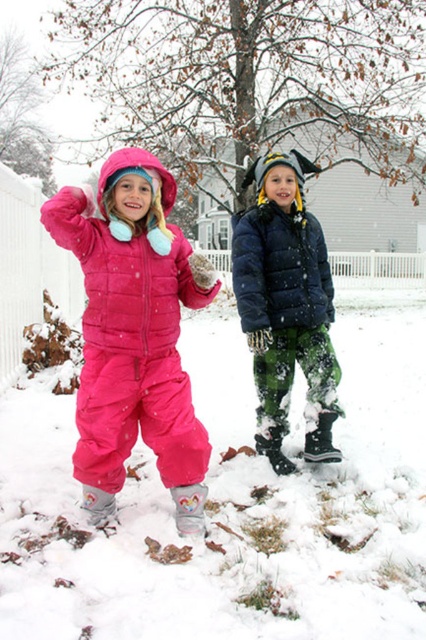
In the scene shown: You are trying to locate the pink matte snowsuit at center and the matte black jacket at center in the snowy scene. Which one is positioned to the left?

The pink matte snowsuit at center is to the left of the matte black jacket at center.

You are a drone operator trying to capture aerial footage of two children playing in the snow. You need to position your drone between the two points marked as point (158, 344) and point (322, 422). Since you want the drone to be closer to the child on the left, which point should you choose?

Point (158, 344) is in front of point (322, 422). Since the child on the left is closer to the front, the drone should be positioned at point (158, 344) to be closer to the child on the left.